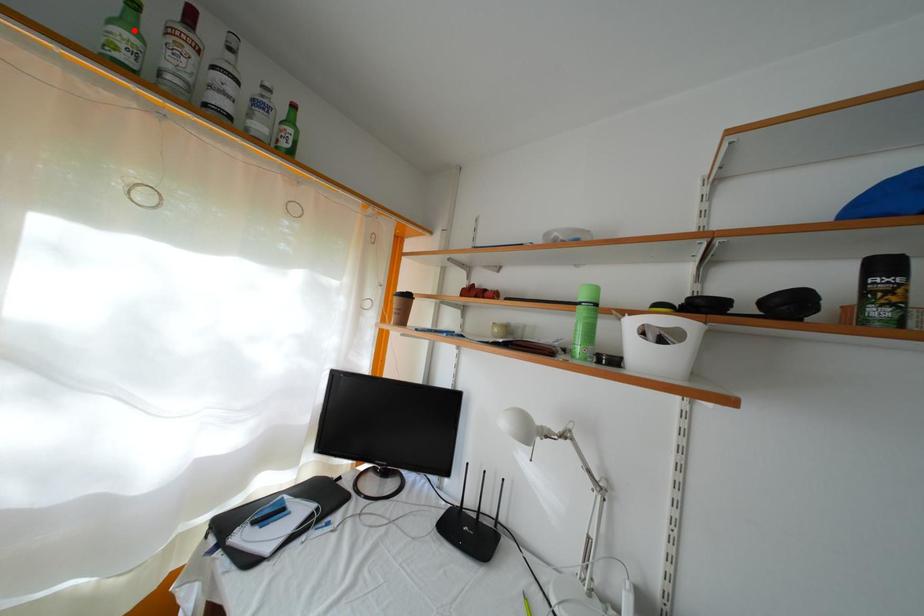
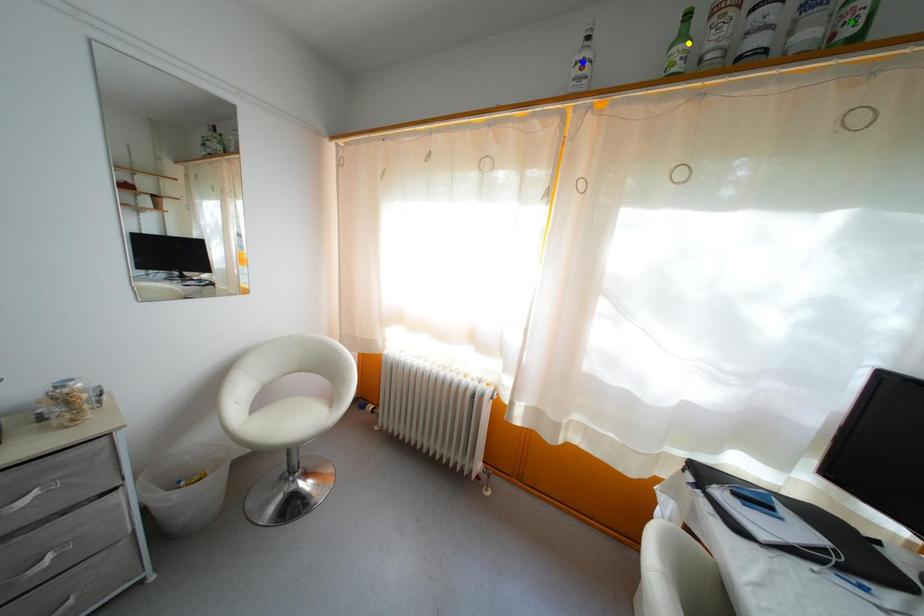
Question: I am providing you with two images of the same scene from different viewpoints. A red point is marked on the first image. You are given multiple points on the second image. Which point in image 2 is actually the same real-world point as the red point in image 1?

Choices:
 (A) yellow point
 (B) green point
 (C) blue point

Answer: (A)